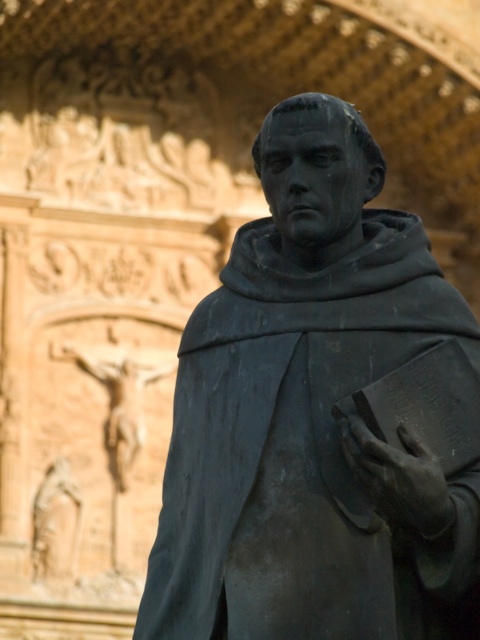
You are standing in front of the bronze statue at center and want to take a photo of it with your camera. The recommended distance for capturing the entire statue in frame is 25 meters. Is the current distance sufficient?

The bronze statue at center and camera are 26.29 meters apart, which is slightly beyond the recommended 25 meters. To capture the entire statue in frame, you should move closer to reduce the distance to 25 meters or less.

You are standing in front of the statue and want to place a small flower bouquet exactly at the point with coordinates point [309,413]. Is this point located on the bronze statue at center?

Yes, the point [309,413] is on the bronze statue at center, so placing the flower bouquet there would be possible.